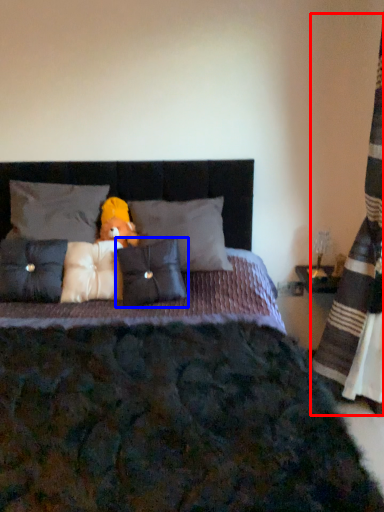
Question: Which point is closer to the camera, curtain (highlighted by a red box) or pillow (highlighted by a blue box)?

Choices:
 (A) curtain
 (B) pillow

Answer: (A)